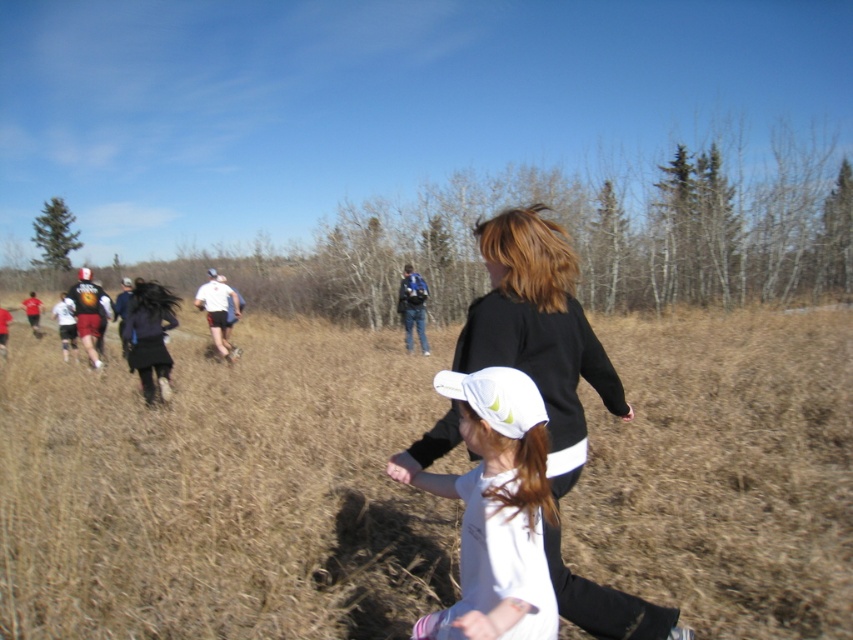
Can you confirm if brown dry grass at center is positioned above white matte shorts at center?

Actually, brown dry grass at center is below white matte shorts at center.

Does point (749, 582) lie in front of point (225, 284)?

Yes.

Does point (311, 356) lie behind point (213, 272)?

Yes, it is behind point (213, 272).

Find the location of a particular element. This screenshot has width=853, height=640. brown dry grass at center is located at coordinates (221, 492).

Is brown dry grass at center further to the viewer compared to black matte jacket at center?

Yes, it is.

Measure the distance between brown dry grass at center and camera.

They are 9.43 feet apart.

I want to click on brown dry grass at center, so click(x=221, y=492).

Can you confirm if brown dry grass at center is smaller than white matte dress at center?

Incorrect, brown dry grass at center is not smaller in size than white matte dress at center.

I want to click on brown dry grass at center, so click(221, 492).

You are a GUI agent. You are given a task and a screenshot of the screen. Output one action in this format:
    pyautogui.click(x=<x>, y=<y>)
    Task: Click on the brown dry grass at center
    This screenshot has width=853, height=640.
    Given the screenshot: What is the action you would take?
    pyautogui.click(x=221, y=492)

This screenshot has width=853, height=640. Find the location of `brown dry grass at center`. brown dry grass at center is located at coordinates (221, 492).